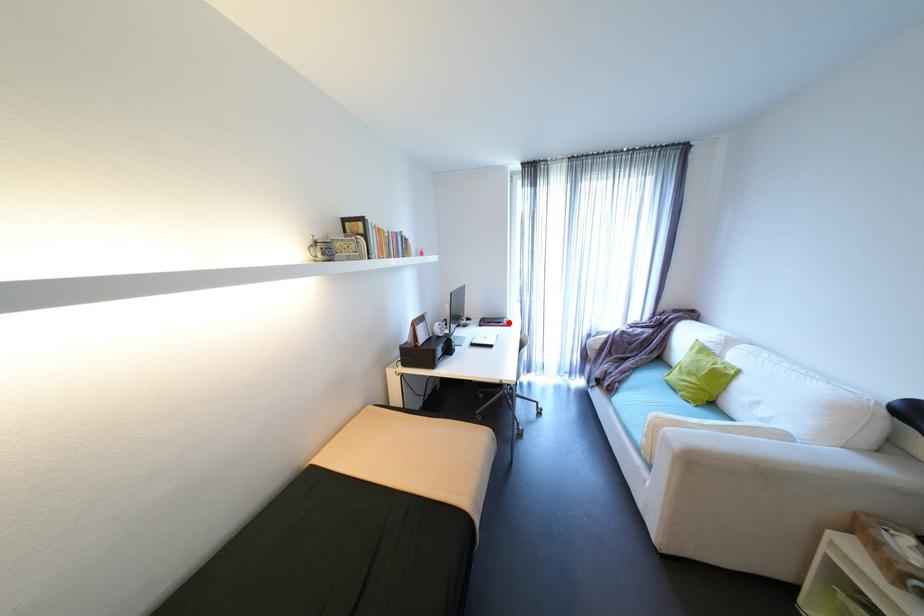
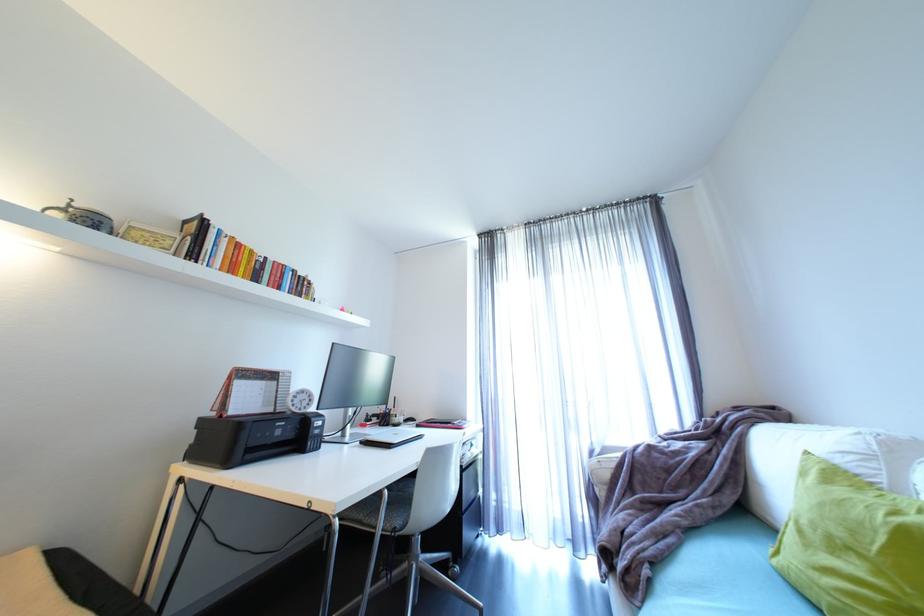
Find the pixel in the second image that matches the highlighted location in the first image.

(457, 424)